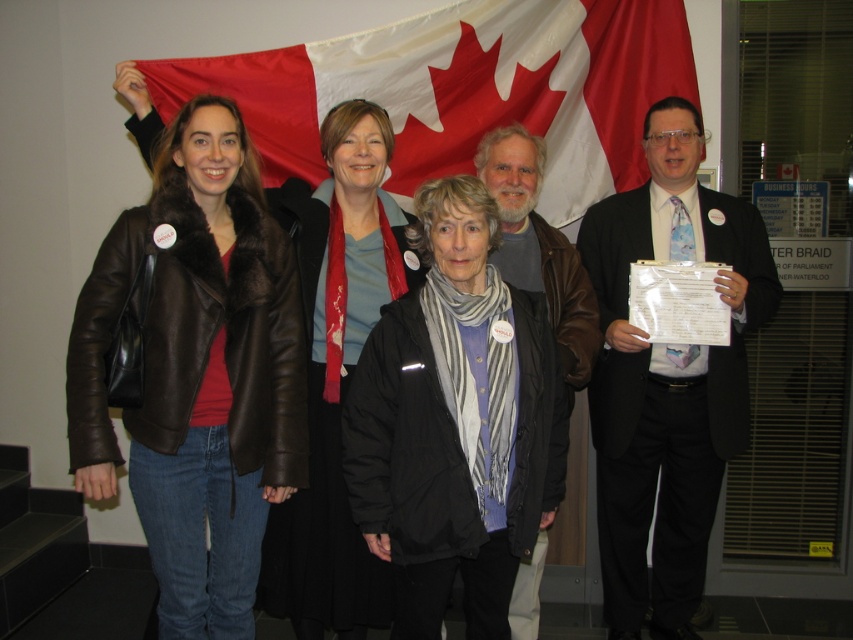
Is point (289, 330) behind point (364, 188)?

No, it is not.

Does brown leather jacket at left have a greater height compared to matte brown leather jacket at center?

In fact, brown leather jacket at left may be shorter than matte brown leather jacket at center.

Who is more forward, (177,524) or (315,545)?

Point (177,524)

Find the location of `brown leather jacket at left`. brown leather jacket at left is located at coordinates (198, 372).

The height and width of the screenshot is (640, 853). What do you see at coordinates (465, 90) in the screenshot? I see `red fabric flag at upper center` at bounding box center [465, 90].

Who is more forward, (308, 44) or (515, 236)?

Point (515, 236) is in front.

Identify the location of red fabric flag at upper center. The width and height of the screenshot is (853, 640). (465, 90).

Who is positioned more to the right, brown leather jacket at left or red fabric flag at upper center?

red fabric flag at upper center is more to the right.

Can you confirm if brown leather jacket at left is taller than red fabric flag at upper center?

Indeed, brown leather jacket at left has a greater height compared to red fabric flag at upper center.

Between point (154, 547) and point (672, 74), which one is positioned in front?

Point (154, 547) is in front.

You are a GUI agent. You are given a task and a screenshot of the screen. Output one action in this format:
    pyautogui.click(x=<x>, y=<y>)
    Task: Click on the brown leather jacket at left
    
    Given the screenshot: What is the action you would take?
    pyautogui.click(x=198, y=372)